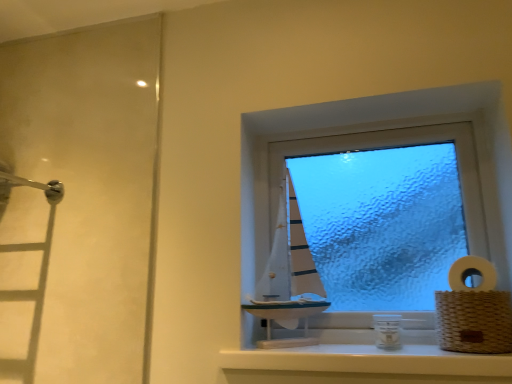
Question: Considering the relative sizes of white woven basket at right and woven brown basket at right in the image provided, is white woven basket at right thinner than woven brown basket at right?

Choices:
 (A) yes
 (B) no

Answer: (A)

Question: Is white woven basket at right behind woven brown basket at right?

Choices:
 (A) no
 (B) yes

Answer: (B)

Question: Is white woven basket at right facing towards woven brown basket at right?

Choices:
 (A) yes
 (B) no

Answer: (B)

Question: Can you confirm if white woven basket at right is positioned to the left of woven brown basket at right?

Choices:
 (A) no
 (B) yes

Answer: (A)

Question: Is white woven basket at right in contact with woven brown basket at right?

Choices:
 (A) yes
 (B) no

Answer: (A)

Question: Does white woven basket at right appear on the right side of woven brown basket at right?

Choices:
 (A) yes
 (B) no

Answer: (A)

Question: Considering the relative positions of woven brown basket at right and white glossy window sill at center in the image provided, is woven brown basket at right in front of white glossy window sill at center?

Choices:
 (A) no
 (B) yes

Answer: (A)

Question: Is woven brown basket at right positioned beyond the bounds of white glossy window sill at center?

Choices:
 (A) no
 (B) yes

Answer: (B)

Question: From the image's perspective, is woven brown basket at right located above white glossy window sill at center?

Choices:
 (A) no
 (B) yes

Answer: (B)

Question: From a real-world perspective, is woven brown basket at right below white glossy window sill at center?

Choices:
 (A) no
 (B) yes

Answer: (A)

Question: From a real-world perspective, is woven brown basket at right physically above white glossy window sill at center?

Choices:
 (A) yes
 (B) no

Answer: (A)

Question: Considering the relative positions of woven brown basket at right and white glossy window sill at center in the image provided, is woven brown basket at right to the left of white glossy window sill at center from the viewer's perspective?

Choices:
 (A) yes
 (B) no

Answer: (B)

Question: From a real-world perspective, is white glossy window sill at center positioned under woven brown basket at right based on gravity?

Choices:
 (A) yes
 (B) no

Answer: (A)